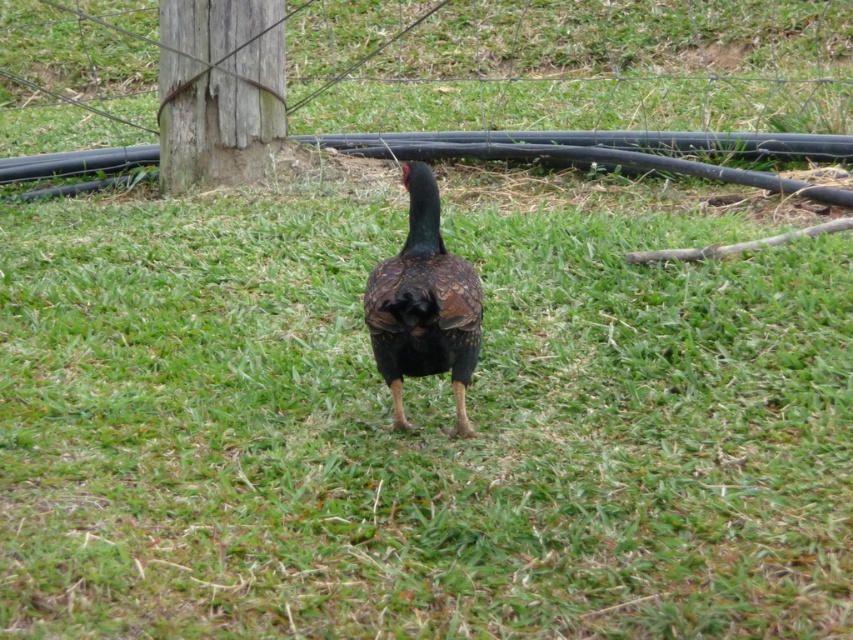
You are standing in the grassy area and want to walk to the wooden post at center. Which direction should you go relative to the shiny brown bird at center?

The wooden post at center is to the left of the shiny brown bird at center, so you should walk to the left of the shiny brown bird at center to reach the wooden post at center.

You are a farmer who needs to reach the wooden post at center to adjust the fence. The shiny brown bird at center is blocking your path. If you walk straight towards the post, will you have to step over the bird?

The distance between the wooden post at center and the shiny brown bird at center is 11.38 feet. Since the bird is blocking your path, you would need to step over it, but given the distance, you can walk around the bird instead of stepping over it.

You are a farmer checking the fence in the enclosure. You notice the wooden post at center and the shiny brown bird at center. Which object is smaller in size?

The wooden post at center is smaller in size compared to the shiny brown bird at center according to the description.